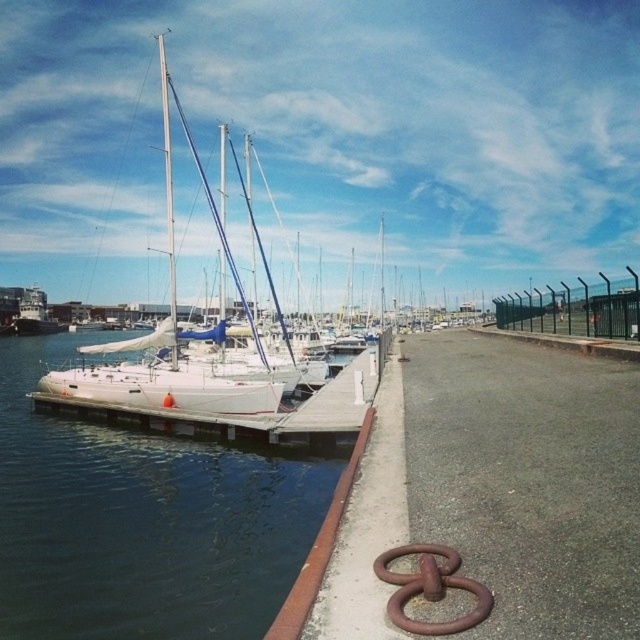
Question: Which object is closer to the camera taking this photo?

Choices:
 (A) rusty metal ring at lower right
 (B) smooth white mast at center
 (C) white glossy water at center
 (D) rusty metal curb at lower left

Answer: (D)

Question: Is white glossy sailboat at center positioned in front of rusty metal ring at lower right?

Choices:
 (A) no
 (B) yes

Answer: (A)

Question: Can you confirm if white glossy sailboat at center is positioned to the left of rusty metal curb at lower left?

Choices:
 (A) yes
 (B) no

Answer: (A)

Question: Which object is the closest to the white glossy water at center?

Choices:
 (A) rusty metal ring at lower right
 (B) rusty metal curb at lower left

Answer: (A)

Question: Which of the following is the closest to the observer?

Choices:
 (A) (205, 182)
 (B) (460, 579)

Answer: (B)

Question: Can you confirm if white glossy water at center is positioned to the left of white glossy sailboat at center?

Choices:
 (A) yes
 (B) no

Answer: (B)